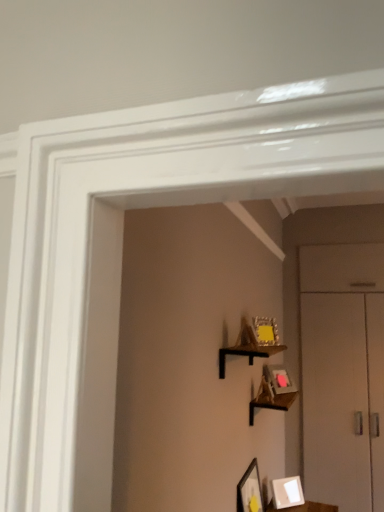
Question: Which direction should I rotate to look at matte gold picture frame at upper center, arranged as the 2th picture frame when viewed from the top, — up or down?

Choices:
 (A) down
 (B) up

Answer: (A)

Question: Which direction should I rotate to look at wooden shelf at center, which is the 1th shelf in back-to-front order, — up or down?

Choices:
 (A) up
 (B) down

Answer: (B)

Question: Could you tell me if wooden picture frame at center, the 1th picture frame when ordered from top to bottom, is turned towards wooden shelf at upper center, the 1th shelf positioned from the front?

Choices:
 (A) yes
 (B) no

Answer: (B)

Question: Is wooden picture frame at center, the 1th picture frame when ordered from top to bottom, positioned beyond the bounds of wooden shelf at upper center, which is the 1th shelf in top-to-bottom order?

Choices:
 (A) no
 (B) yes

Answer: (B)

Question: From the image's perspective, is wooden picture frame at center, the 5th picture frame ordered from the bottom, beneath wooden shelf at upper center, the 1th shelf positioned from the front?

Choices:
 (A) yes
 (B) no

Answer: (B)

Question: Is wooden picture frame at center, the 5th picture frame ordered from the bottom, shorter than wooden shelf at upper center, which is the 2th shelf in back-to-front order?

Choices:
 (A) no
 (B) yes

Answer: (A)

Question: Is wooden picture frame at center, the 5th picture frame ordered from the bottom, positioned behind wooden shelf at upper center, which is the 2th shelf in back-to-front order?

Choices:
 (A) no
 (B) yes

Answer: (B)

Question: Considering the relative positions of wooden picture frame at center, the 1th picture frame when ordered from top to bottom, and wooden shelf at upper center, which is the 2th shelf in back-to-front order, in the image provided, is wooden picture frame at center, the 1th picture frame when ordered from top to bottom, to the left of wooden shelf at upper center, which is the 2th shelf in back-to-front order, from the viewer's perspective?

Choices:
 (A) no
 (B) yes

Answer: (B)

Question: From a real-world perspective, is white matte picture frame at lower center, which is the first picture frame in bottom-to-top order, over wooden shelf at upper center, which is the 2th shelf in back-to-front order?

Choices:
 (A) yes
 (B) no

Answer: (B)

Question: From the image's perspective, would you say white matte picture frame at lower center, which is the first picture frame in bottom-to-top order, is shown under wooden shelf at upper center, which is the 1th shelf in top-to-bottom order?

Choices:
 (A) no
 (B) yes

Answer: (B)

Question: Is white matte picture frame at lower center, which is the first picture frame in bottom-to-top order, positioned with its back to wooden shelf at upper center, the 1th shelf positioned from the front?

Choices:
 (A) no
 (B) yes

Answer: (A)

Question: Does white matte picture frame at lower center, which is the first picture frame in bottom-to-top order, have a greater height compared to wooden shelf at upper center, which is the 2th shelf in back-to-front order?

Choices:
 (A) yes
 (B) no

Answer: (A)

Question: Is white matte picture frame at lower center, marked as the 5th picture frame in a top-to-bottom arrangement, further to camera compared to wooden shelf at upper center, which is the 2th shelf in back-to-front order?

Choices:
 (A) yes
 (B) no

Answer: (A)

Question: Considering the relative positions of matte gold picture frame at upper center, arranged as the 2th picture frame when viewed from the top, and wooden shelf at upper center, which is the 1th shelf in top-to-bottom order, in the image provided, is matte gold picture frame at upper center, arranged as the 2th picture frame when viewed from the top, in front of wooden shelf at upper center, which is the 1th shelf in top-to-bottom order,?

Choices:
 (A) yes
 (B) no

Answer: (B)